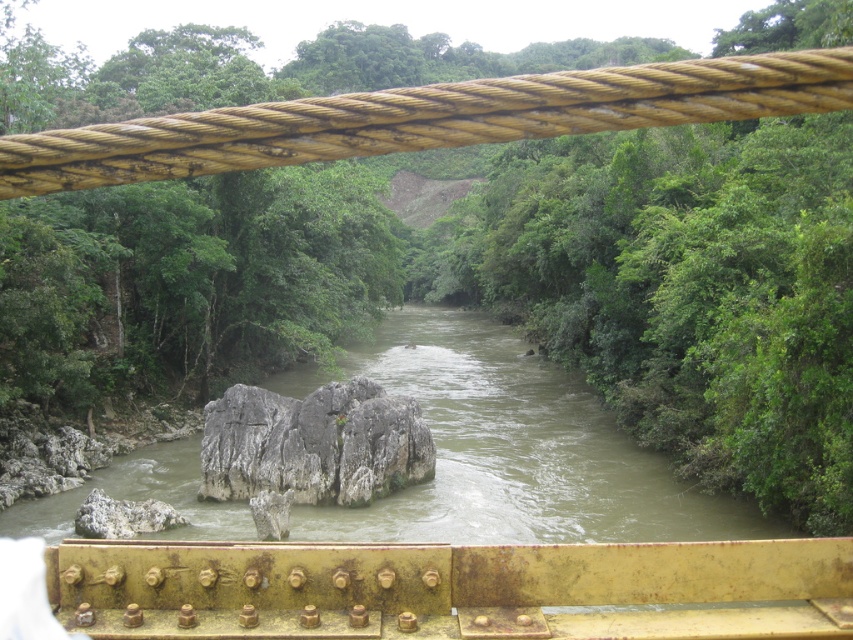
You are standing on a bridge overlooking the river. You see the brown muddy water at center and the gray rough rock at center. Which object is closer to you?

The brown muddy water at center is closer to you because it is in front of the gray rough rock at center.

You are standing on a bridge overlooking the river and notice the rusty yellow rope at upper center and the gray rough rock at center. Which object is closer to you as you look out from the bridge?

The rusty yellow rope at upper center is closer to you because it is positioned in front of the gray rough rock at center.